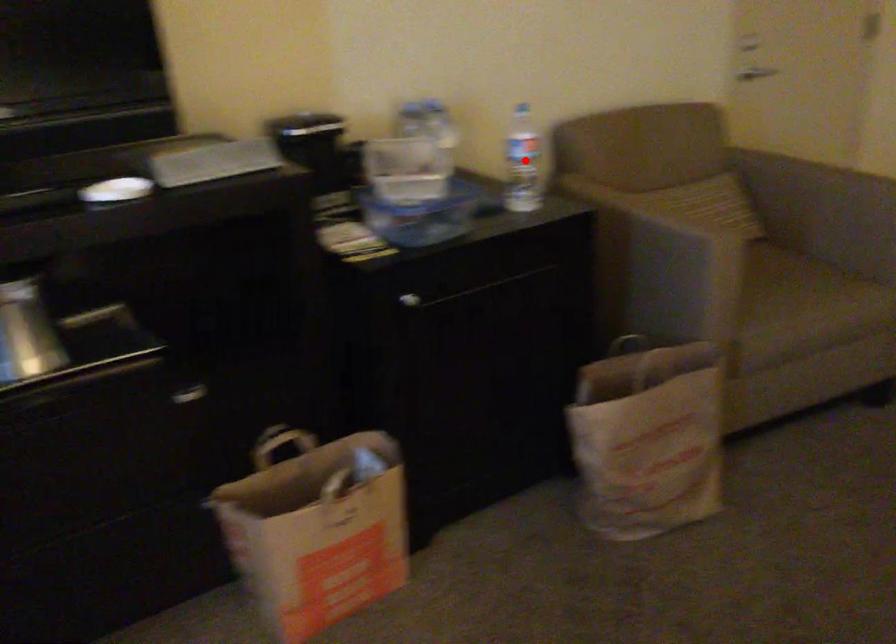
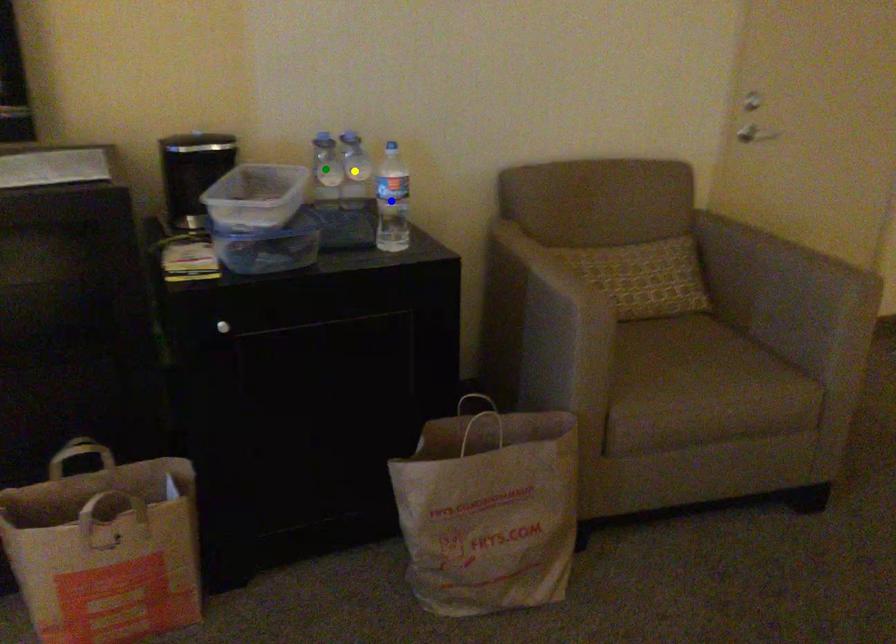
Question: I am providing you with two images of the same scene from different viewpoints. A red point is marked on the first image. You are given multiple points on the second image. Can you choose the point in image 2 that corresponds to the point in image 1?

Choices:
 (A) green point
 (B) yellow point
 (C) blue point

Answer: (C)